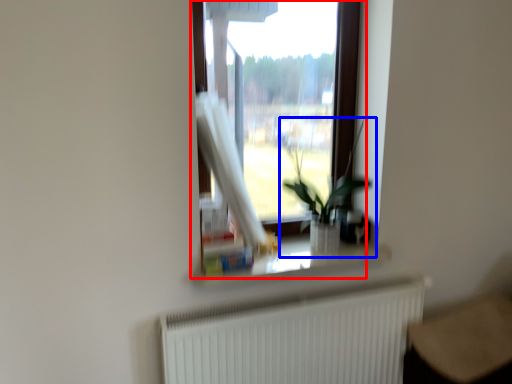
Question: Which object is further to the camera taking this photo, window (highlighted by a red box) or houseplant (highlighted by a blue box)?

Choices:
 (A) window
 (B) houseplant

Answer: (A)